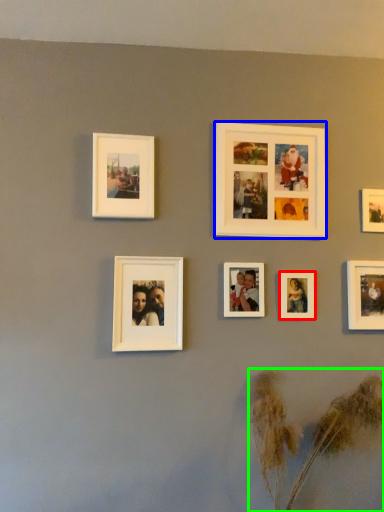
Question: Estimate the real-world distances between objects in this image. Which object is closer to picture frame (highlighted by a red box), picture frame (highlighted by a blue box) or plant (highlighted by a green box)?

Choices:
 (A) picture frame
 (B) plant

Answer: (A)